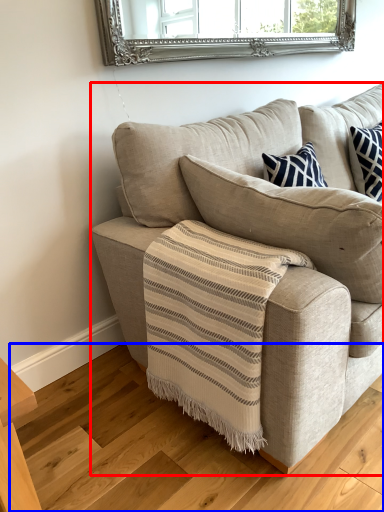
Question: Which point is closer to the camera, studio couch (highlighted by a red box) or stair (highlighted by a blue box)?

Choices:
 (A) studio couch
 (B) stair

Answer: (B)